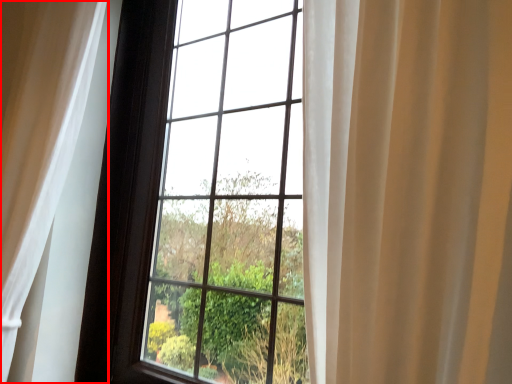
Question: Considering the relative positions of curtain (annotated by the red box) and bay window in the image provided, where is curtain (annotated by the red box) located with respect to the staircase?

Choices:
 (A) left
 (B) right

Answer: (A)